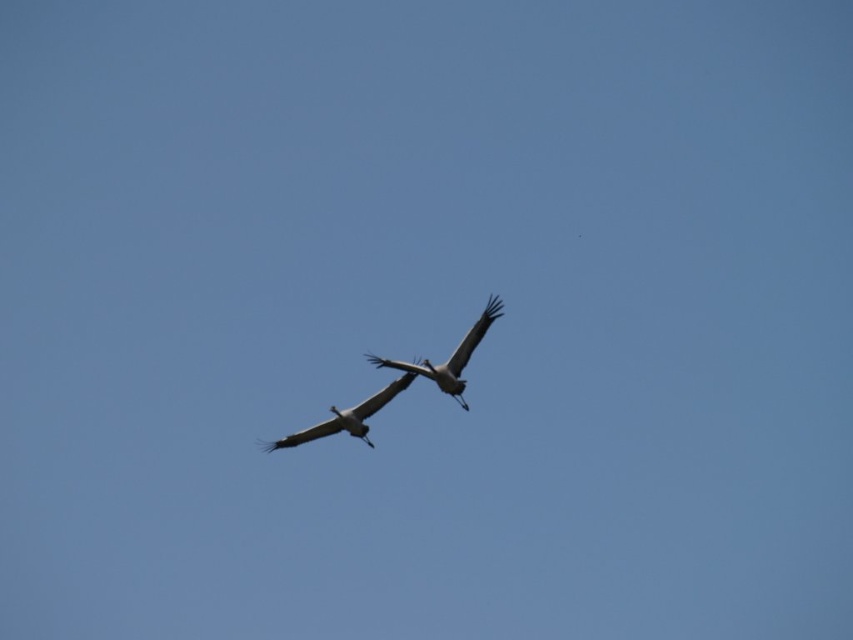
Question: Does gray matte bird at center lie behind white feathered bird at center?

Choices:
 (A) yes
 (B) no

Answer: (B)

Question: Which point is farther to the camera?

Choices:
 (A) (434, 368)
 (B) (270, 449)

Answer: (B)

Question: Can you confirm if gray matte bird at center is positioned to the left of white feathered bird at center?

Choices:
 (A) no
 (B) yes

Answer: (A)

Question: Does gray matte bird at center appear on the left side of white feathered bird at center?

Choices:
 (A) yes
 (B) no

Answer: (B)